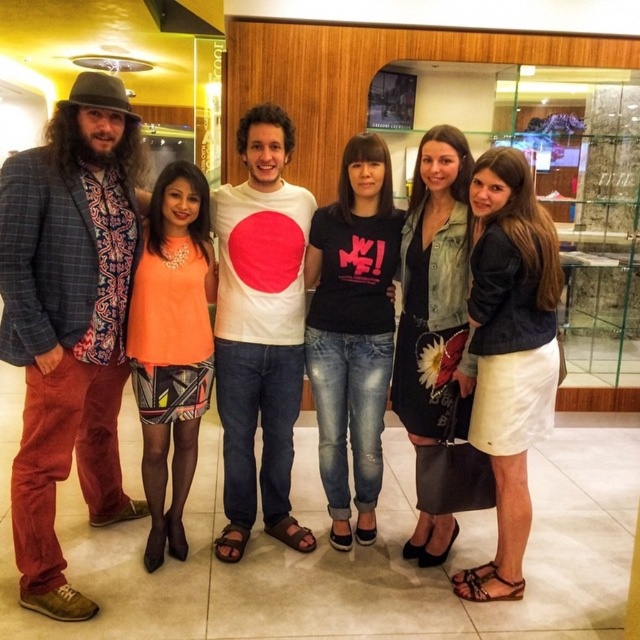
Question: Which is farther from the plaid wool blazer at left?

Choices:
 (A) white matte t-shirt at center
 (B) green felt cowboy hat at left
 (C) orange fabric dress at center
 (D) white cotton skirt at lower right

Answer: (D)

Question: Does black cotton t-shirt at center appear over green felt cowboy hat at left?

Choices:
 (A) yes
 (B) no

Answer: (B)

Question: Is white matte t-shirt at center wider than denim jacket at center?

Choices:
 (A) yes
 (B) no

Answer: (A)

Question: Which of the following is the closest to the observer?

Choices:
 (A) denim jacket at center
 (B) black cotton t-shirt at center
 (C) green felt cowboy hat at left

Answer: (C)

Question: Which of the following is the farthest from the observer?

Choices:
 (A) (502, 180)
 (B) (253, 323)
 (C) (332, 502)
 (D) (156, 332)

Answer: (C)

Question: Can you confirm if white cotton skirt at lower right is smaller than black cotton t-shirt at center?

Choices:
 (A) yes
 (B) no

Answer: (B)